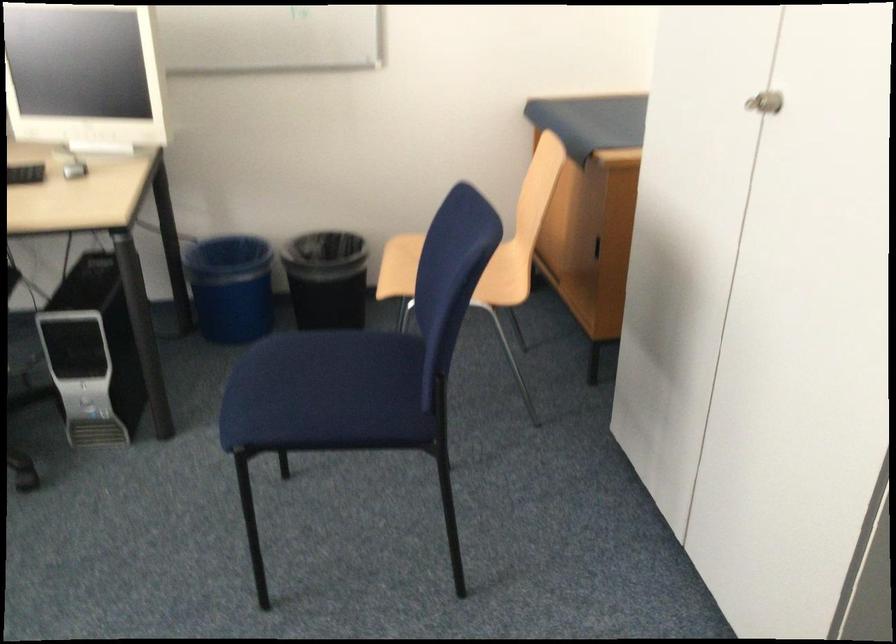
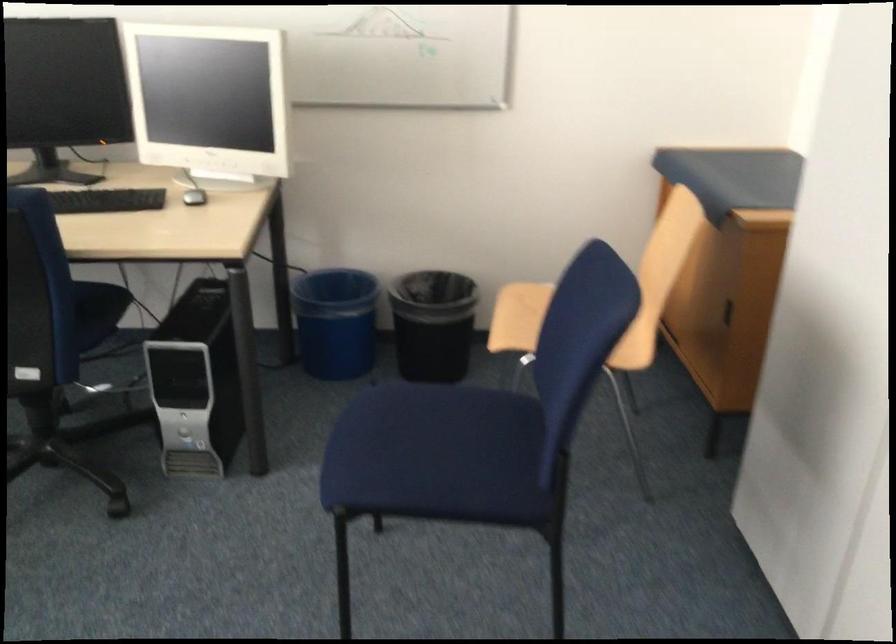
Question: The camera is either moving clockwise (left) or counter-clockwise (right) around the object. The first image is from the beginning of the video and the second image is from the end. Is the camera moving left or right when shooting the video?

Choices:
 (A) Left
 (B) Right

Answer: (B)